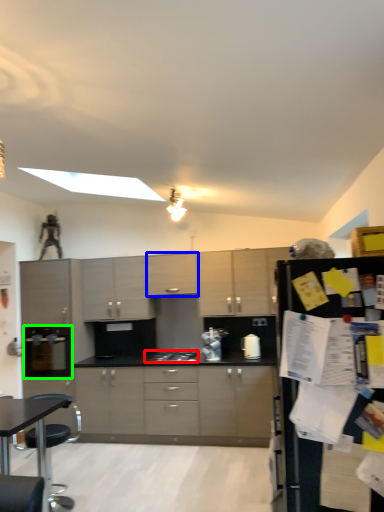
Question: Estimate the real-world distances between objects in this image. Which object is farther from gas stove (highlighted by a red box), cabinetry (highlighted by a blue box) or appliance (highlighted by a green box)?

Choices:
 (A) cabinetry
 (B) appliance

Answer: (B)